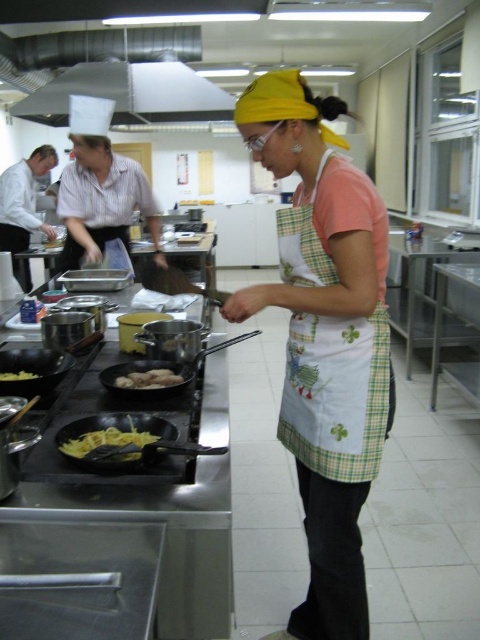
Is yellow matte chicken at center positioned at the back of yellow matte food at lower left?

No, yellow matte chicken at center is closer to the viewer.

Between point (127, 376) and point (13, 380), which one is positioned in front?

Point (13, 380)

Is point (158, 384) positioned after point (0, 378)?

No, it is not.

This screenshot has height=640, width=480. In order to click on yellow matte chicken at center in this screenshot , I will do `click(148, 380)`.

Which is in front, point (308, 212) or point (204, 445)?

Point (204, 445) is more forward.

Measure the distance between green checkered apron at center and camera.

1.24 meters

Locate an element on the screen. green checkered apron at center is located at coordinates (334, 333).

Which is in front, point (168, 435) or point (100, 376)?

Point (168, 435) is more forward.

Where is `black non-stick frying pan at center`? The height and width of the screenshot is (640, 480). black non-stick frying pan at center is located at coordinates (124, 440).

Is point (146, 416) in front of point (145, 371)?

Yes, it is.

Where is `black non-stick frying pan at center`? This screenshot has height=640, width=480. black non-stick frying pan at center is located at coordinates (124, 440).